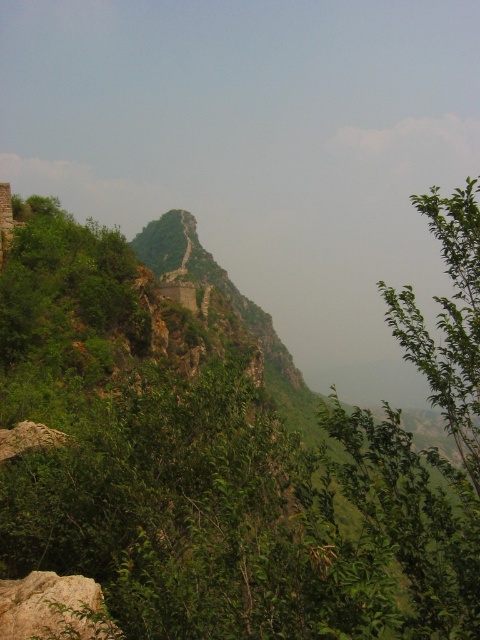
You are standing at the center of the mountain path and see a point marked at coordinates (447, 320). What object is located at that point?

The point at coordinates (447, 320) marks a green leafy tree at right.

You are standing at the center of the image looking towards the mountain. Which direction should you walk to reach the green leafy tree at right?

A: The green leafy tree at right is located at point (447, 320), which is to the right side of the image. Since you are at the center, you should walk towards the right to reach it.